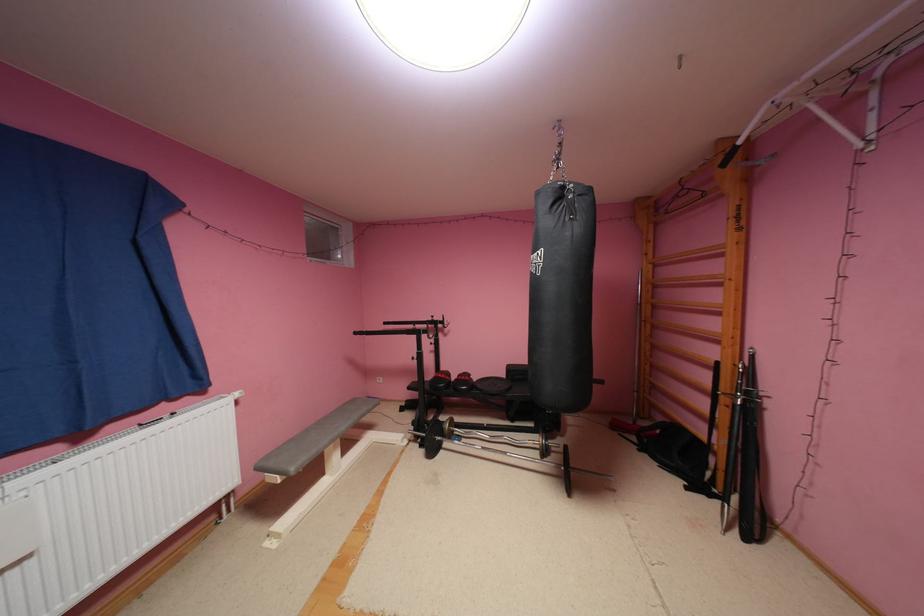
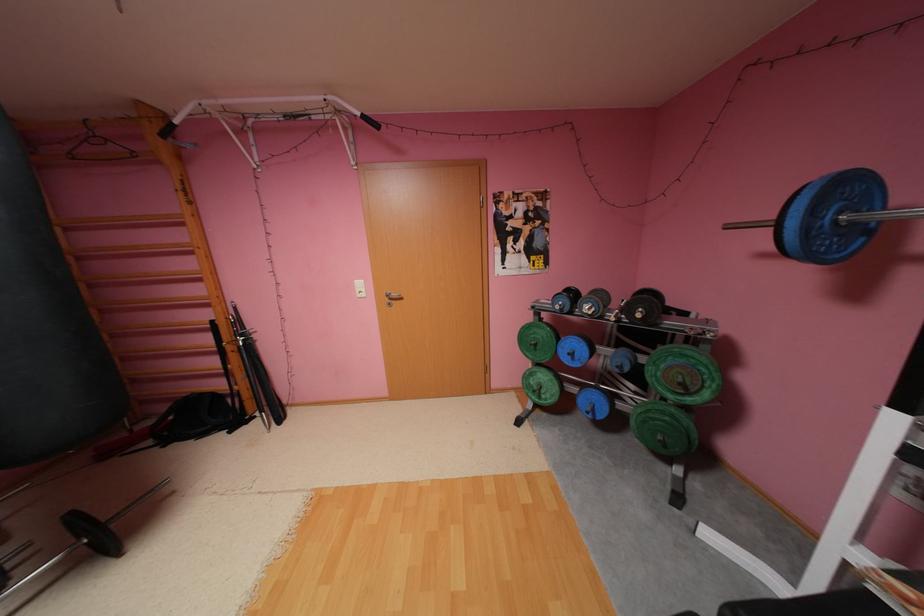
The point at (664, 265) is marked in the first image. Where is the corresponding point in the second image?

(76, 229)